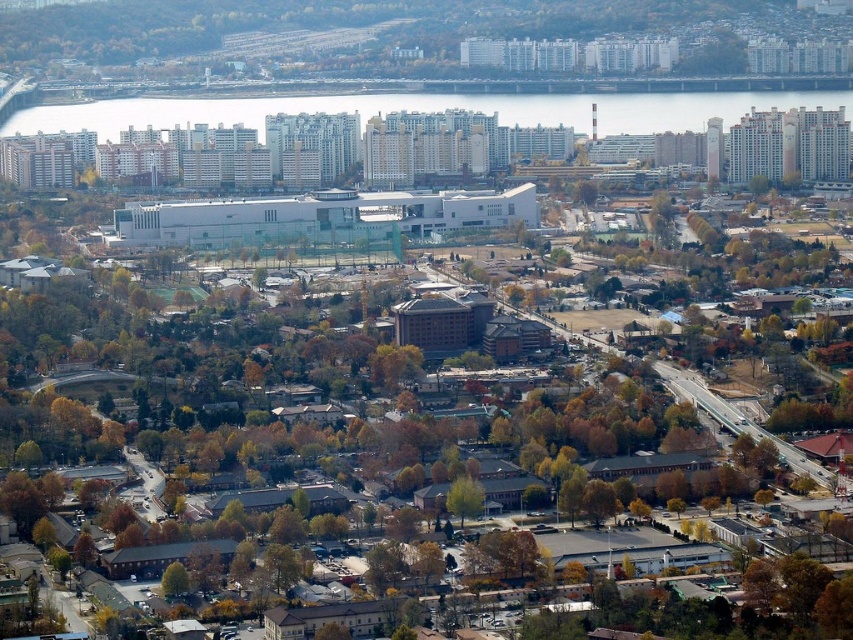
Question: Is clear water at center to the left of green leafy tree at lower left from the viewer's perspective?

Choices:
 (A) yes
 (B) no

Answer: (B)

Question: Is clear water at center smaller than green leafy tree at lower left?

Choices:
 (A) yes
 (B) no

Answer: (B)

Question: Considering the real-world distances, which object is closest to the green leafy tree at lower left?

Choices:
 (A) green leafy tree at center
 (B) clear water at center

Answer: (A)

Question: Among these objects, which one is farthest from the camera?

Choices:
 (A) green leafy tree at center
 (B) clear water at center

Answer: (B)

Question: Among these points, which one is nearest to the camera?

Choices:
 (A) (172, 568)
 (B) (32, 113)

Answer: (A)

Question: Can you confirm if clear water at center is bigger than green leafy tree at center?

Choices:
 (A) yes
 (B) no

Answer: (A)